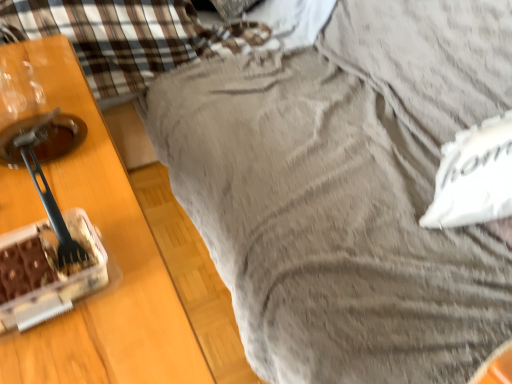
Question: Does point (496, 215) appear closer or farther from the camera than point (117, 188)?

Choices:
 (A) farther
 (B) closer

Answer: (A)

Question: Is white fabric pillow at right to the left or to the right of wooden table at left in the image?

Choices:
 (A) left
 (B) right

Answer: (B)

Question: From the image's perspective, is white fabric pillow at right located above or below wooden table at left?

Choices:
 (A) below
 (B) above

Answer: (B)

Question: Is wooden table at left to the left or to the right of white fabric pillow at right in the image?

Choices:
 (A) left
 (B) right

Answer: (A)

Question: Considering the positions of wooden table at left and white fabric pillow at right in the image, is wooden table at left bigger or smaller than white fabric pillow at right?

Choices:
 (A) small
 (B) big

Answer: (B)

Question: Is wooden table at left in front of or behind white fabric pillow at right in the image?

Choices:
 (A) front
 (B) behind

Answer: (A)

Question: From the image's perspective, is wooden table at left positioned above or below white fabric pillow at right?

Choices:
 (A) below
 (B) above

Answer: (A)